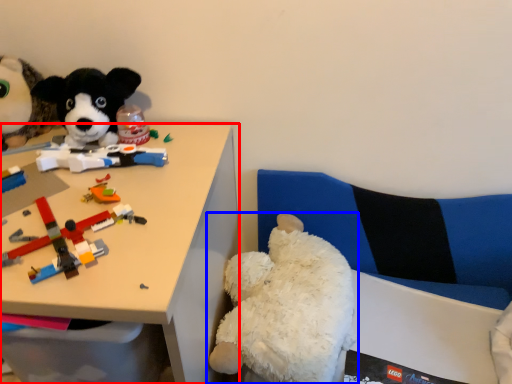
Question: Which point is further to the camera, desk (highlighted by a red box) or toy (highlighted by a blue box)?

Choices:
 (A) desk
 (B) toy

Answer: (B)